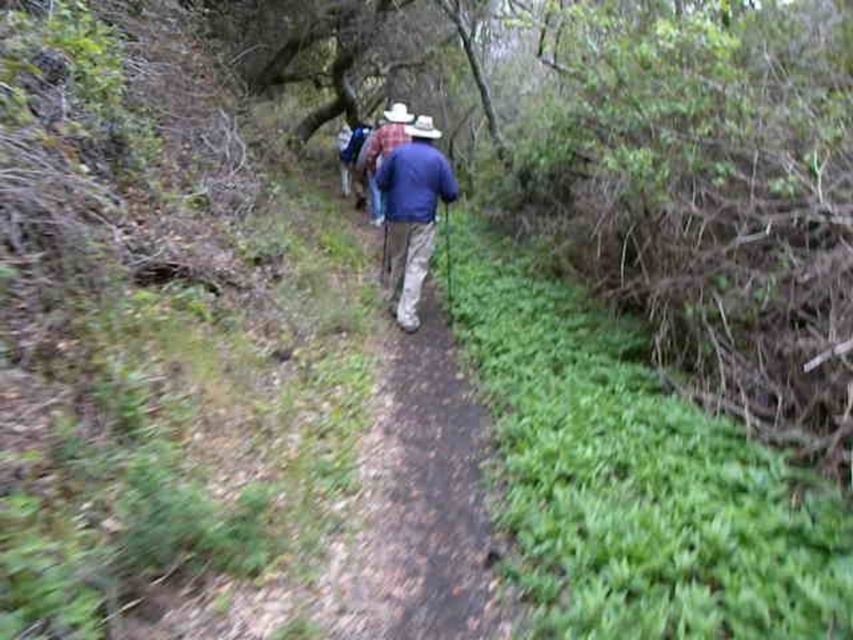
Who is more forward, (x=352, y=604) or (x=440, y=188)?

Point (x=352, y=604)

Which is more to the right, brown dirt path at center or blue fabric jacket at center?

From the viewer's perspective, brown dirt path at center appears more on the right side.

Between point (428, 280) and point (407, 266), which one is positioned in front?

Positioned in front is point (407, 266).

Where is `brown dirt path at center`? The image size is (853, 640). brown dirt path at center is located at coordinates (422, 504).